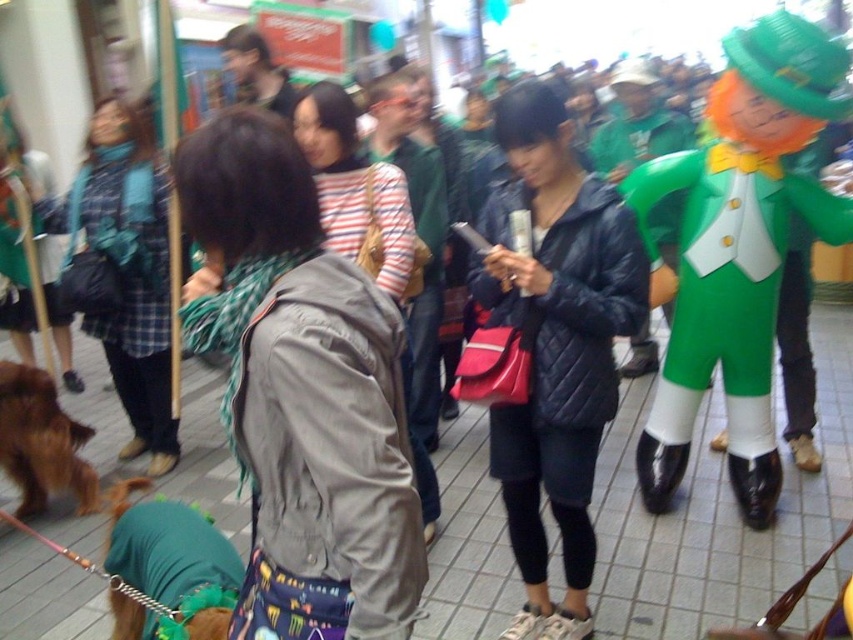
Does matte black jacket at center have a lesser width compared to green fabric costume at right?

Yes, matte black jacket at center is thinner than green fabric costume at right.

Who is more distant from viewer, (635, 284) or (726, 220)?

The point (726, 220) is more distant.

At what (x,y) coordinates should I click in order to perform the action: click on matte black jacket at center. Please return your answer as a coordinate pair (x, y). This screenshot has height=640, width=853. Looking at the image, I should click on (564, 372).

The image size is (853, 640). What are the coordinates of `matte black jacket at center` in the screenshot? It's located at (564, 372).

Is point (164, 422) positioned in front of point (340, 93)?

No.

Is plaid fabric jacket at left thinner than striped fabric at center?

In fact, plaid fabric jacket at left might be wider than striped fabric at center.

Is point (161, 442) in front of point (337, 221)?

No, it is not.

The width and height of the screenshot is (853, 640). What are the coordinates of `plaid fabric jacket at left` in the screenshot? It's located at (125, 272).

Which is in front, point (260, 371) or point (390, 268)?

Point (260, 371) is in front.

Is matte gray jacket at center to the left of striped fabric at center from the viewer's perspective?

Indeed, matte gray jacket at center is positioned on the left side of striped fabric at center.

Does point (267, 346) come in front of point (381, 212)?

That is True.

In order to click on matte gray jacket at center in this screenshot , I will do `click(318, 438)`.